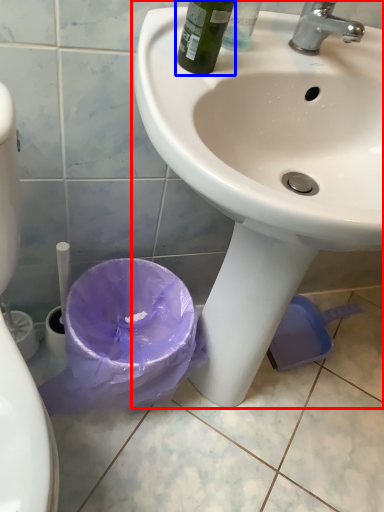
Question: Among these objects, which one is nearest to the camera, sink (highlighted by a red box) or bottle (highlighted by a blue box)?

Choices:
 (A) sink
 (B) bottle

Answer: (A)